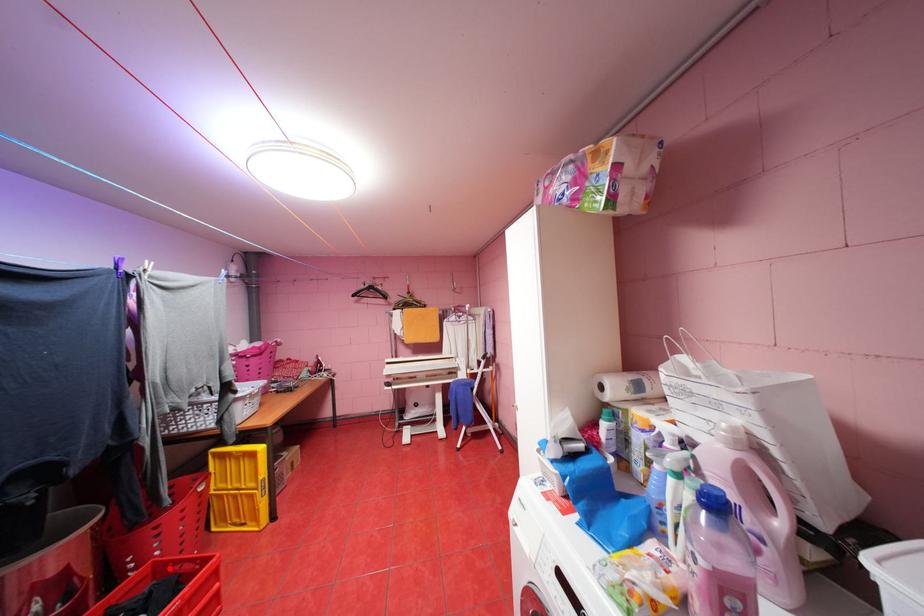
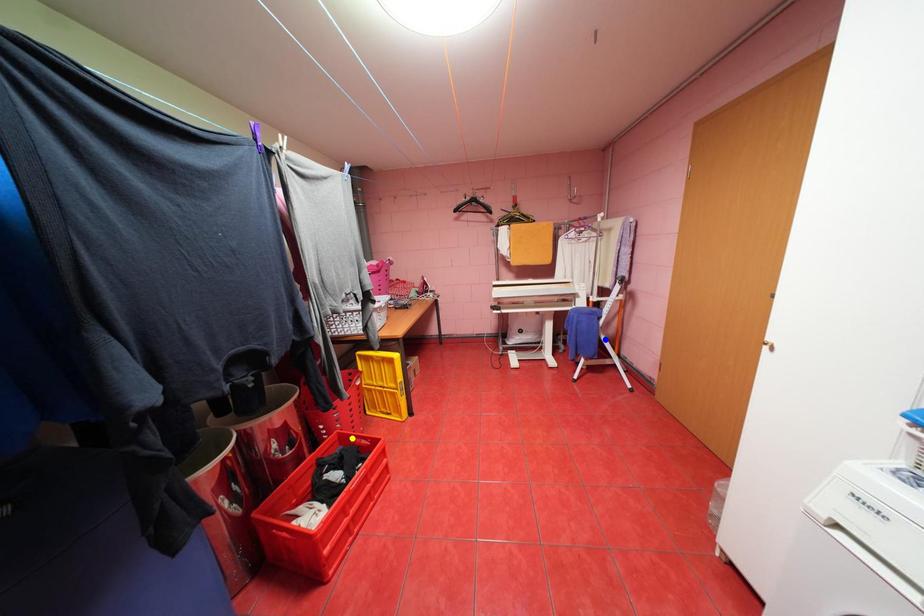
Question: I am providing you with two images of the same scene from different viewpoints. A red point is marked on the first image. You are given multiple points on the second image. Which point in image 2 is actually the same real-world point as the red point in image 1?

Choices:
 (A) yellow point
 (B) green point
 (C) blue point

Answer: (A)